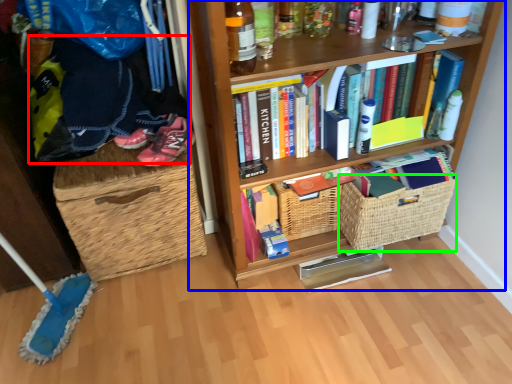
Question: Considering the real-world distances, which object is farthest from clothing (highlighted by a red box)? bookcase (highlighted by a blue box) or basket (highlighted by a green box)?

Choices:
 (A) bookcase
 (B) basket

Answer: (B)